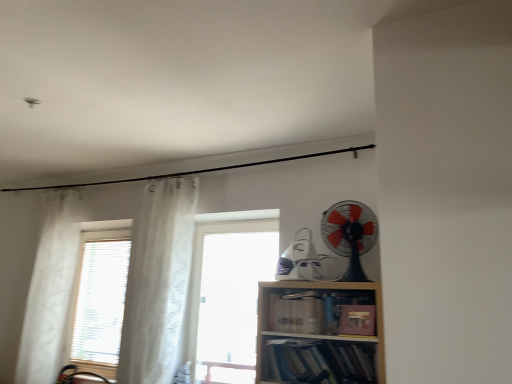
Question: From the image's perspective, would you say black plastic fan at upper right is shown under hardcover books at lower center, the 1th book ordered from the bottom?

Choices:
 (A) yes
 (B) no

Answer: (B)

Question: Does black plastic fan at upper right turn towards hardcover books at lower center, the 1th book ordered from the bottom?

Choices:
 (A) yes
 (B) no

Answer: (B)

Question: Does black plastic fan at upper right have a larger size compared to hardcover books at lower center, the 1th book ordered from the bottom?

Choices:
 (A) yes
 (B) no

Answer: (A)

Question: Can you confirm if black plastic fan at upper right is taller than hardcover books at lower center, the 3th book from the top?

Choices:
 (A) no
 (B) yes

Answer: (B)

Question: Would you say black plastic fan at upper right is outside hardcover books at lower center, the 3th book from the top?

Choices:
 (A) no
 (B) yes

Answer: (B)

Question: Based on their positions, is white sheer curtain at left, arranged as the second curtain when viewed from the left, located to the left or right of wooden bookshelf at center?

Choices:
 (A) right
 (B) left

Answer: (B)

Question: Considering their positions, is white sheer curtain at left, arranged as the second curtain when viewed from the left, located in front of or behind wooden bookshelf at center?

Choices:
 (A) behind
 (B) front

Answer: (A)

Question: Based on their sizes in the image, would you say white sheer curtain at left, which is counted as the first curtain, starting from the right, is bigger or smaller than wooden bookshelf at center?

Choices:
 (A) big
 (B) small

Answer: (B)

Question: From a real-world perspective, is white sheer curtain at left, which is counted as the first curtain, starting from the right, physically located above or below wooden bookshelf at center?

Choices:
 (A) above
 (B) below

Answer: (A)

Question: From a real-world perspective, is brown leather book at lower right, acting as the 1th book starting from the top, positioned above or below hardcover books at lower center, the 3th book from the top?

Choices:
 (A) above
 (B) below

Answer: (A)

Question: Considering the relative positions of brown leather book at lower right, positioned as the 3th book in bottom-to-top order, and hardcover books at lower center, the 1th book ordered from the bottom, in the image provided, is brown leather book at lower right, positioned as the 3th book in bottom-to-top order, to the left or to the right of hardcover books at lower center, the 1th book ordered from the bottom,?

Choices:
 (A) left
 (B) right

Answer: (B)

Question: In terms of width, does brown leather book at lower right, acting as the 1th book starting from the top, look wider or thinner when compared to hardcover books at lower center, the 1th book ordered from the bottom?

Choices:
 (A) wide
 (B) thin

Answer: (B)

Question: Is point (372, 324) positioned closer to the camera than point (358, 349)?

Choices:
 (A) closer
 (B) farther

Answer: (A)

Question: Would you say transparent glass window at center is inside or outside white sheer curtain at left, which is counted as the first curtain, starting from the right?

Choices:
 (A) inside
 (B) outside

Answer: (B)

Question: In terms of width, does transparent glass window at center look wider or thinner when compared to white sheer curtain at left, which is counted as the first curtain, starting from the right?

Choices:
 (A) wide
 (B) thin

Answer: (A)